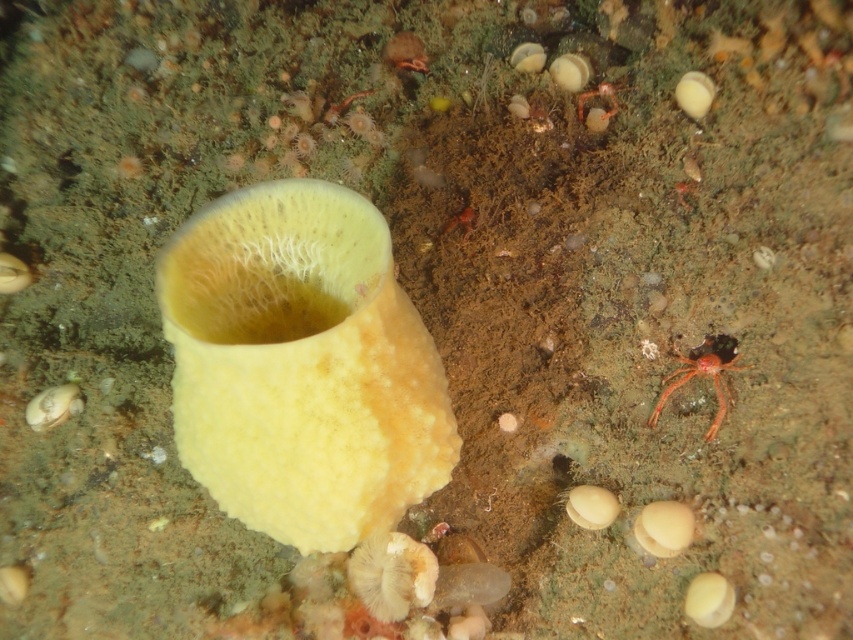
You are a marine biologist diving at the ocean floor and see the translucent orange spider at lower right. You need to collect a sample from it. Your sampling tool has a maximum reach of 3 feet. Can you collect the sample without moving closer?

The translucent orange spider at lower right and the viewer are 3.61 feet apart. Since the sampling tool only reaches 3 feet, you cannot collect the sample without moving closer.

You are a marine biologist studying the underwater environment. You notice a translucent orange spider at lower right and a translucent orange crab at upper center. How far apart are these two creatures?

The translucent orange spider at lower right is 36.23 centimeters from the translucent orange crab at upper center.

You are a marine biologist observing the underwater scene. You notice the translucent orange spider at lower right and the translucent orange crab at upper center. Which of these two creatures is positioned more to the east in the image?

The translucent orange spider at lower right is to the right of the translucent orange crab at upper center, so it is positioned more to the east in the image.